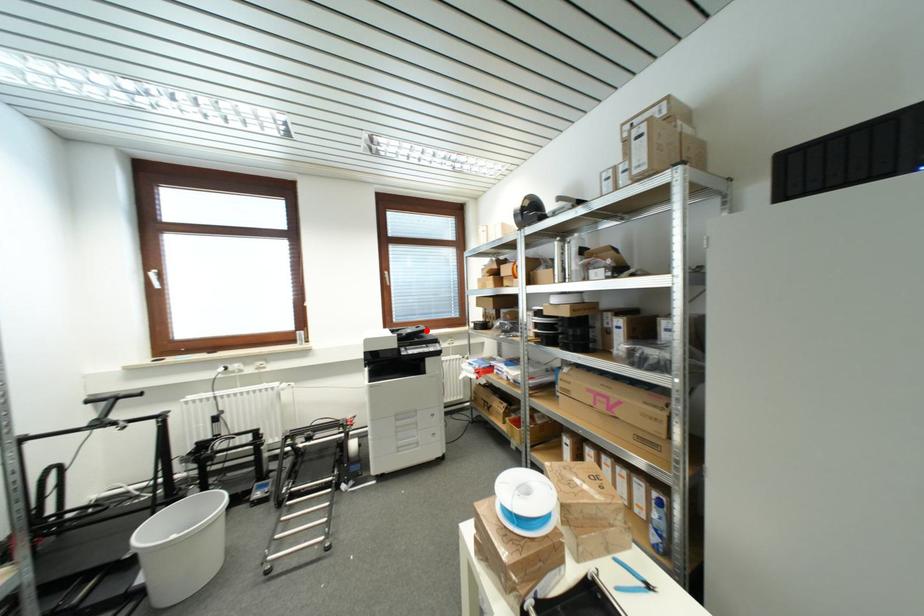
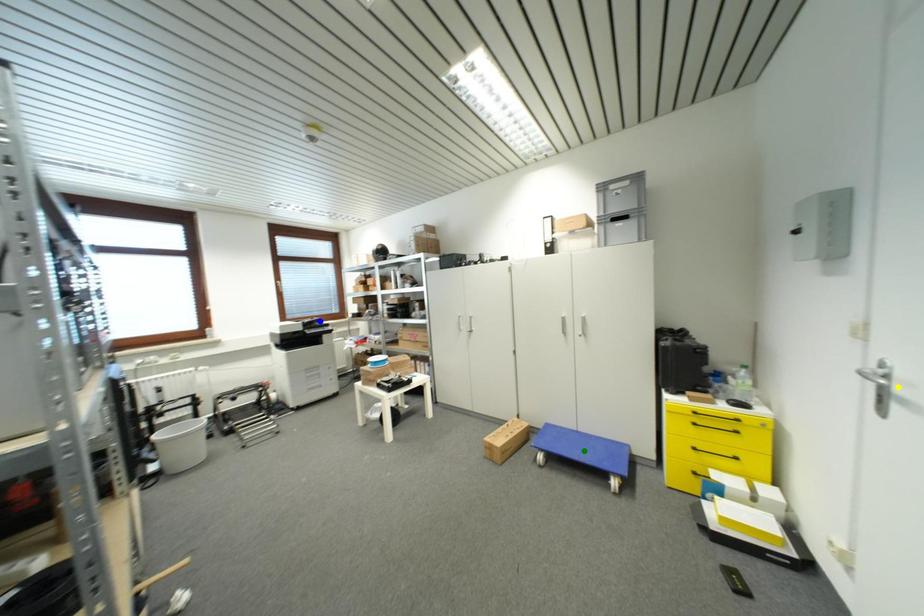
Question: I am providing you with two images of the same scene from different viewpoints. A red point is marked on the first image. You are given multiple points on the second image. Which point in image 2 is actually the same real-world point as the red point in image 1?

Choices:
 (A) blue point
 (B) yellow point
 (C) green point

Answer: (A)